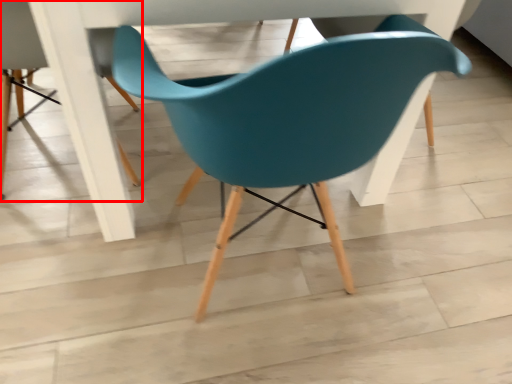
Question: In this image, where is chair (annotated by the red box) located relative to chair?

Choices:
 (A) right
 (B) left

Answer: (B)